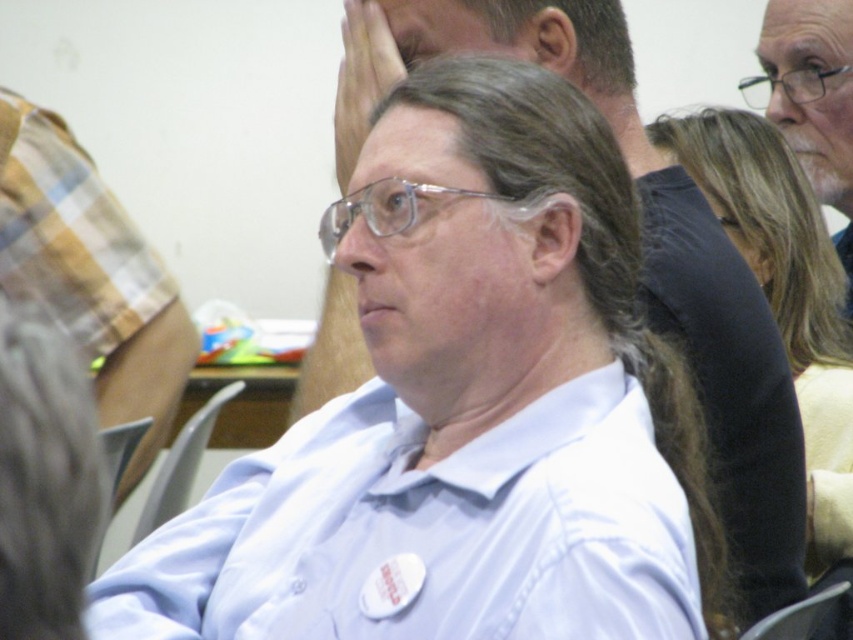
You are standing in the conference room and want to determine which of the two points, point (364, 356) or point (659, 148), is nearer to you. Based on the image, which point is closer?

Point (364, 356) is closer to the camera than point (659, 148), so it is the nearer point.

In the scene shown: You are standing in the room where the meeting is taking place. You see a point marked at coordinates (426, 532). What object is located at that point?

The white smooth shirt at center is located at point (426, 532).